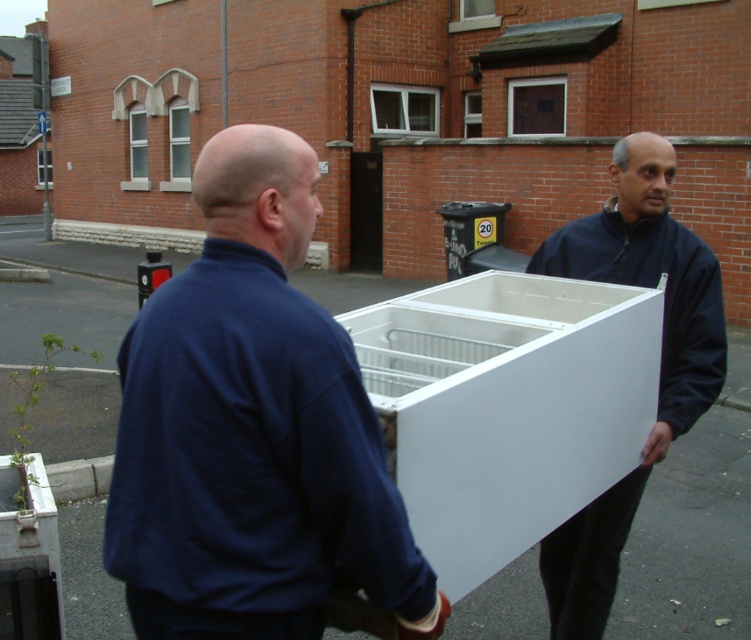
Question: Observing the image, what is the correct spatial positioning of blue fabric jacket at center in reference to matte white cabinet at right?

Choices:
 (A) right
 (B) left

Answer: (B)

Question: Which point appears closest to the camera in this image?

Choices:
 (A) (608, 273)
 (B) (356, 580)

Answer: (B)

Question: Is blue fabric jacket at center further to camera compared to matte white cabinet at right?

Choices:
 (A) yes
 (B) no

Answer: (B)

Question: Is blue fabric jacket at center positioned behind matte white cabinet at right?

Choices:
 (A) no
 (B) yes

Answer: (A)